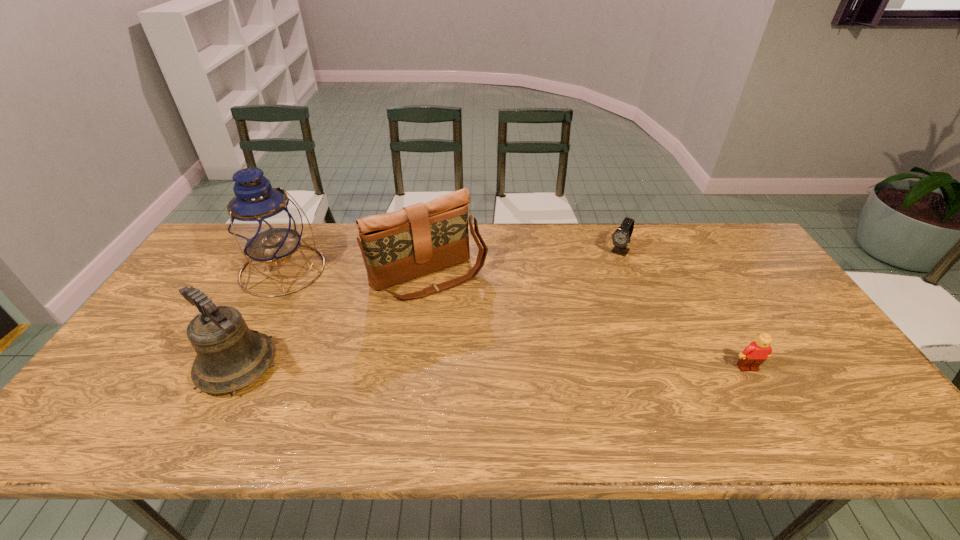
The height and width of the screenshot is (540, 960). I want to click on vacant spot on the desktop that is between the bell and the rightmost object and is positioned on the front-facing side of the tallest object, so click(x=423, y=367).

The width and height of the screenshot is (960, 540). I want to click on vacant spot on the desktop that is between the bell and the Lego and is positioned on the face of the watch, so 538,367.

At what (x,y) coordinates should I click in order to perform the action: click on vacant space on the desktop that is between the bell and the rightmost object and is positioned on the front-facing side of the shoulder bag. Please return your answer as a coordinate pair (x, y). This screenshot has height=540, width=960. Looking at the image, I should click on (492, 367).